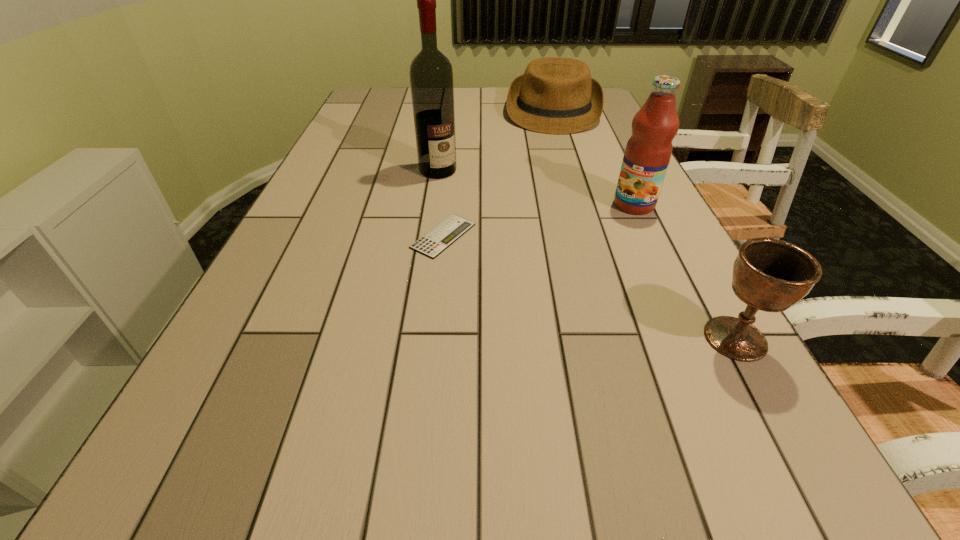
Identify the location of chalice that is positioned at the right edge. (770, 275).

You are a GUI agent. You are given a task and a screenshot of the screen. Output one action in this format:
    pyautogui.click(x=<x>, y=<y>)
    Task: Click on the fedora that is at the right edge
    
    Given the screenshot: What is the action you would take?
    pyautogui.click(x=555, y=95)

Identify the location of fruit juice at the right edge. The height and width of the screenshot is (540, 960). (648, 151).

At what (x,y) coordinates should I click in order to perform the action: click on object that is positioned at the far right corner. Please return your answer as a coordinate pair (x, y). This screenshot has height=540, width=960. Looking at the image, I should click on (555, 95).

The width and height of the screenshot is (960, 540). Identify the location of vacant space at the left edge of the desktop. (357, 121).

I want to click on vacant space at the right edge, so click(625, 216).

Where is `free space at the far left corner of the desktop`? free space at the far left corner of the desktop is located at coordinates (377, 105).

Where is `free space between the calculator and the fedora`? The width and height of the screenshot is (960, 540). free space between the calculator and the fedora is located at coordinates (498, 173).

Identify the location of empty space that is in between the second tallest object and the second farthest object. The height and width of the screenshot is (540, 960). (536, 187).

This screenshot has height=540, width=960. Find the location of `blank region between the shortest object and the nearest object`. blank region between the shortest object and the nearest object is located at coordinates (589, 287).